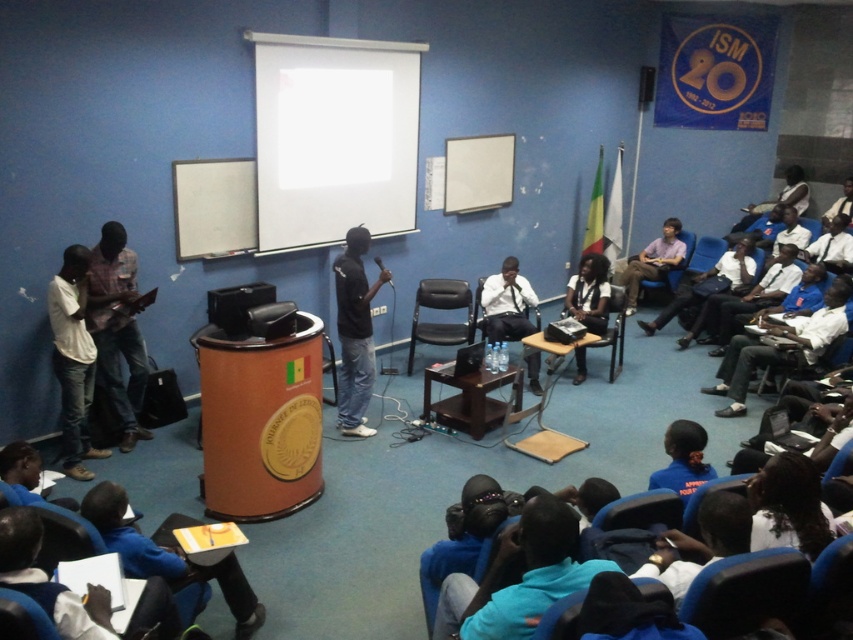
You are a person who is 1.7 meters tall. You want to sit in one of the chairs in the room. The black plastic chair at center and the blue fabric chair at lower center are available. Which chair would allow you to comfortably rest your feet on the floor without straining your legs?

The blue fabric chair at lower center is shorter than the black plastic chair at center. Since you are 1.7 meters tall, the blue fabric chair at lower center would allow you to comfortably rest your feet on the floor without straining your legs because it has a lower seat height.

You are organizing a photoshoot and need to ensure that all objects in the image are visible. Given that the black matte shirt at center and the black fabric chair at lower center are both black, how can you differentiate them in the final photo?

The black matte shirt at center is larger in size than the black fabric chair at lower center, so the shirt will appear bigger in the photo, making it easier to distinguish between the two black objects.